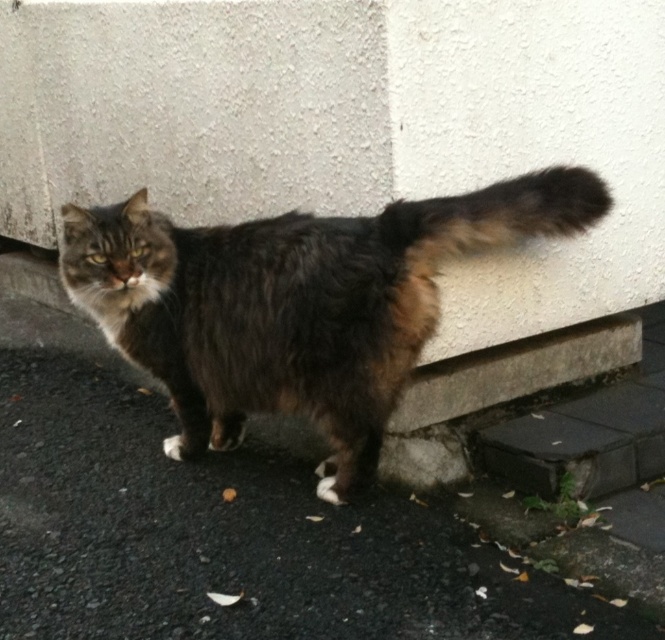
Question: Estimate the real-world distances between objects in this image. Which object is closer to the fuzzy brown tail at upper right?

Choices:
 (A) fuzzy brown cat at center
 (B) dark asphalt pavement at lower center

Answer: (A)

Question: Can you confirm if dark asphalt pavement at lower center is thinner than fuzzy brown tail at upper right?

Choices:
 (A) yes
 (B) no

Answer: (B)

Question: Which point is farther from the camera taking this photo?

Choices:
 (A) (467, 193)
 (B) (595, 221)
 (C) (104, 499)

Answer: (A)

Question: Is dark asphalt pavement at lower center further to the viewer compared to fuzzy brown tail at upper right?

Choices:
 (A) yes
 (B) no

Answer: (B)

Question: Does dark asphalt pavement at lower center have a larger size compared to fuzzy brown cat at center?

Choices:
 (A) yes
 (B) no

Answer: (A)

Question: Considering the real-world distances, which object is closest to the dark asphalt pavement at lower center?

Choices:
 (A) fuzzy brown tail at upper right
 (B) fuzzy brown cat at center

Answer: (B)